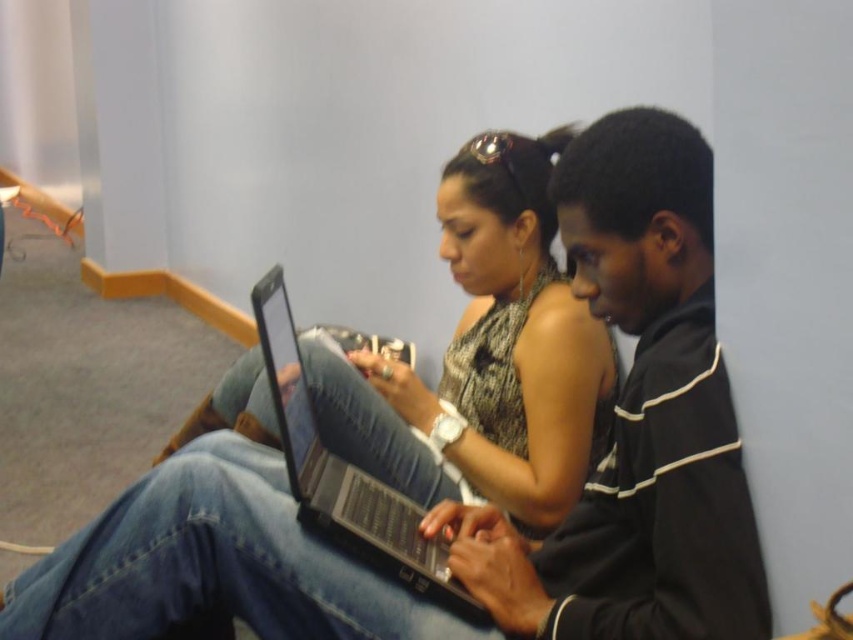
Does matte black laptop at center have a lesser width compared to black matte laptop at center?

In fact, matte black laptop at center might be wider than black matte laptop at center.

Who is more distant from viewer, (556,449) or (340,490)?

Point (556,449)

Which is in front, point (602, 369) or point (277, 378)?

Point (277, 378) is more forward.

Identify the location of matte black laptop at center. point(489,355).